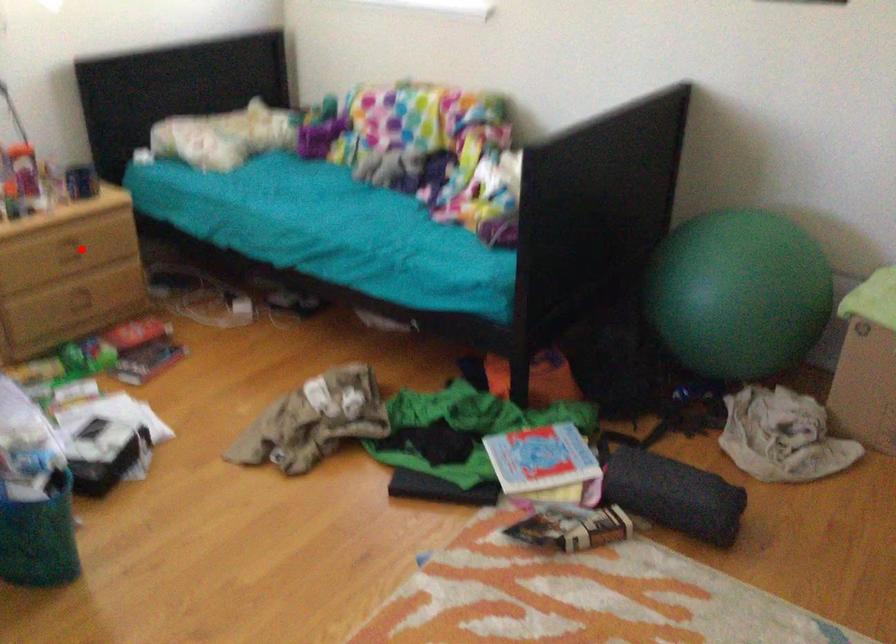
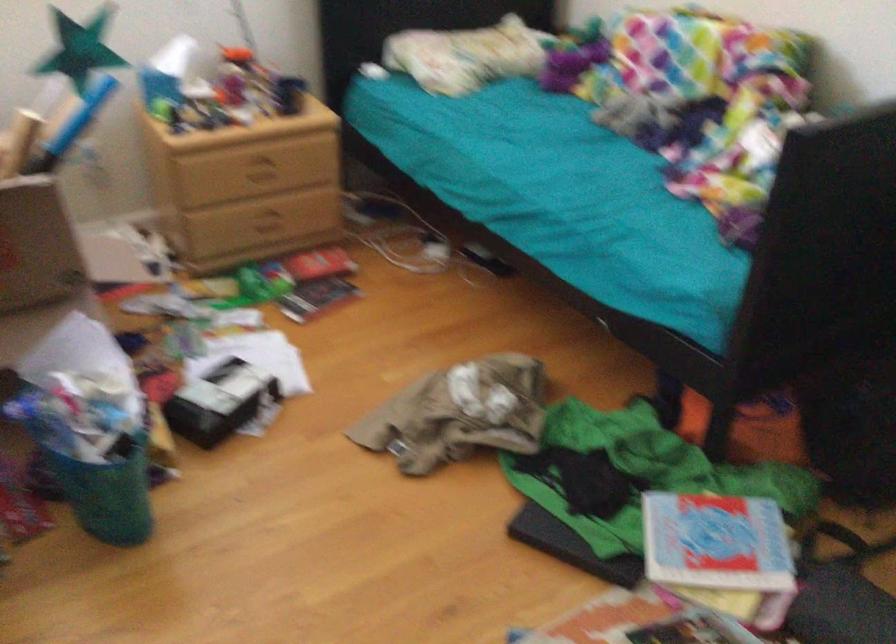
Locate, in the second image, the point that corresponds to the highlighted location in the first image.

(266, 172)